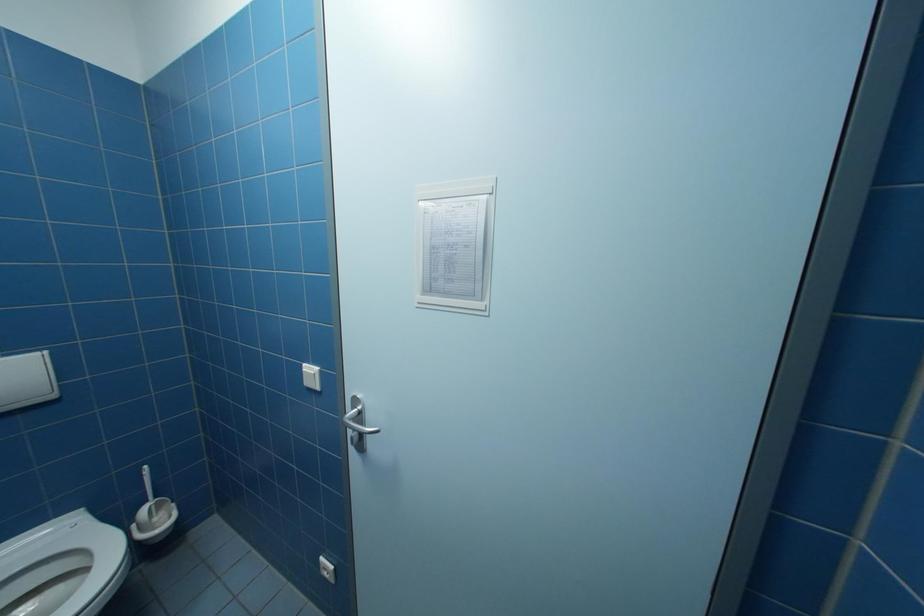
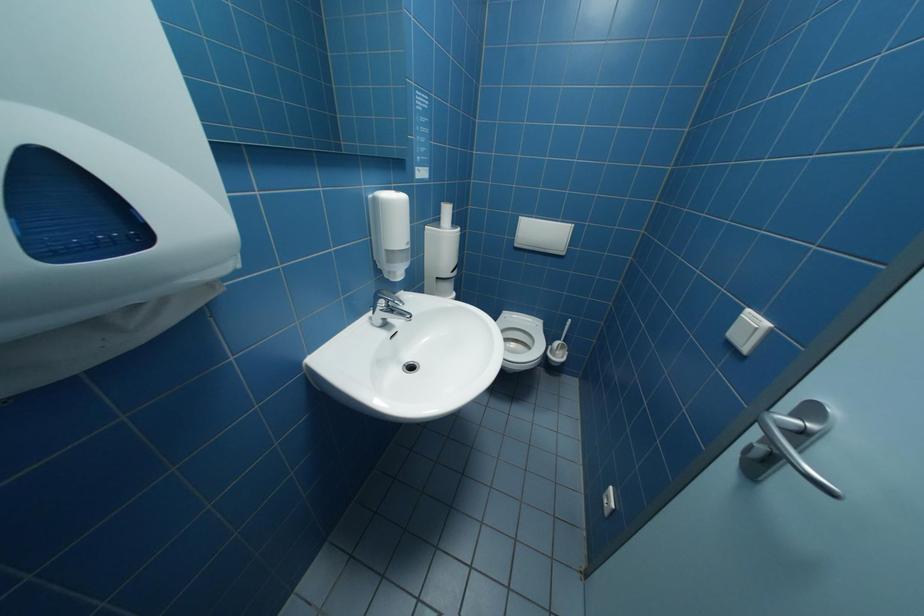
First-person continuous shooting, in which direction is the camera rotating?

The camera's rotation is toward left-down.